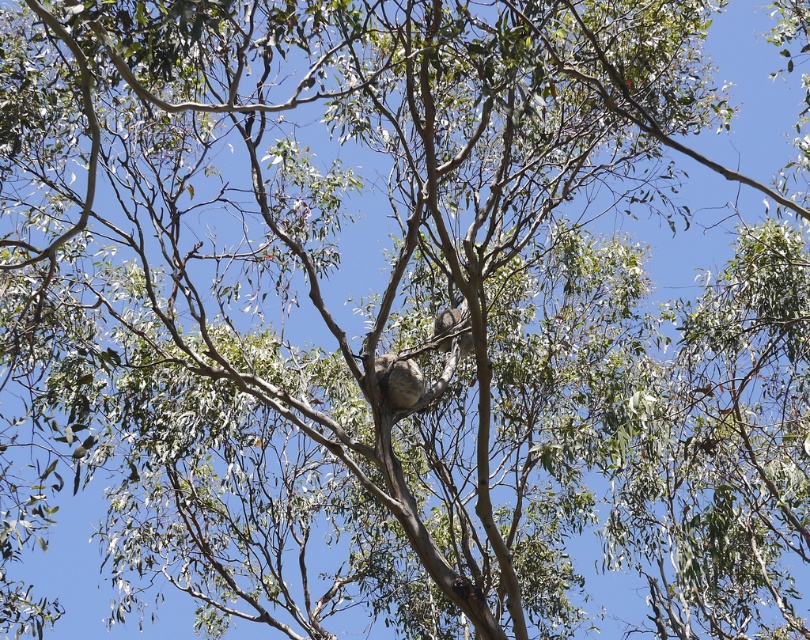
Question: Is fuzzy brown koala at center further to camera compared to fuzzy gray koala at center?

Choices:
 (A) yes
 (B) no

Answer: (B)

Question: Can you confirm if fuzzy brown koala at center is thinner than fuzzy gray koala at center?

Choices:
 (A) yes
 (B) no

Answer: (B)

Question: Is fuzzy brown koala at center positioned at the back of fuzzy gray koala at center?

Choices:
 (A) yes
 (B) no

Answer: (B)